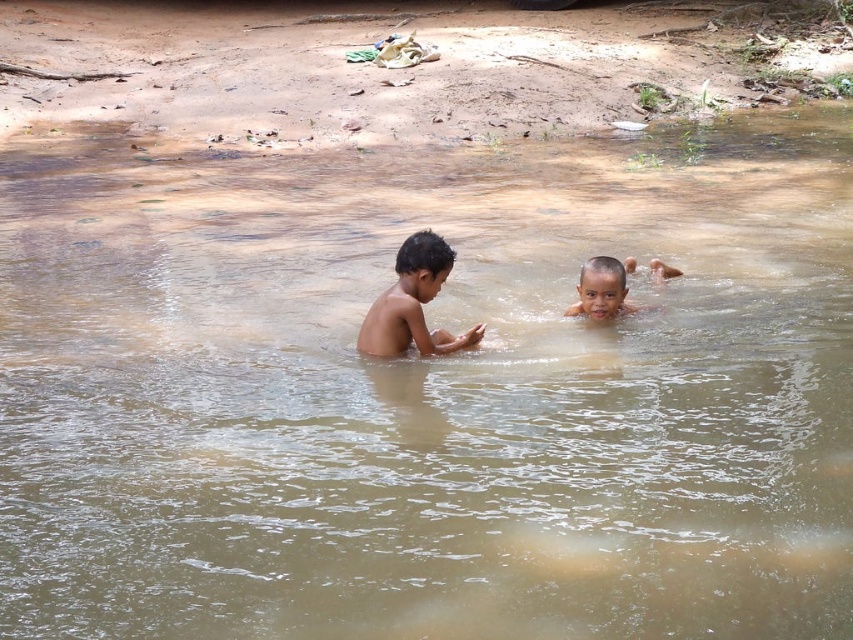
Can you confirm if light brown skin at center is positioned to the left of smooth skin child at center?

Yes, light brown skin at center is to the left of smooth skin child at center.

Between light brown skin at center and smooth skin child at center, which one has more height?

With more height is light brown skin at center.

Is point (432, 262) positioned before point (622, 285)?

That is True.

Where is `light brown skin at center`? This screenshot has width=853, height=640. light brown skin at center is located at coordinates (413, 304).